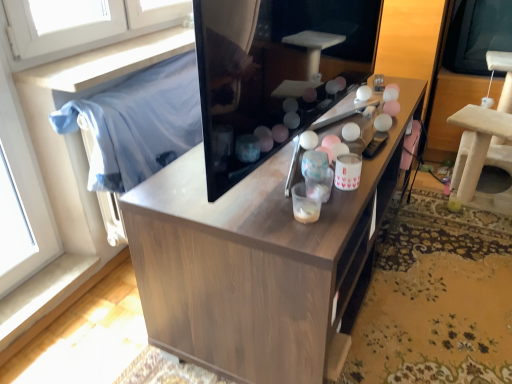
Locate an element on the screen. blank space above blue fabric at left (from a real-world perspective) is located at coordinates (156, 82).